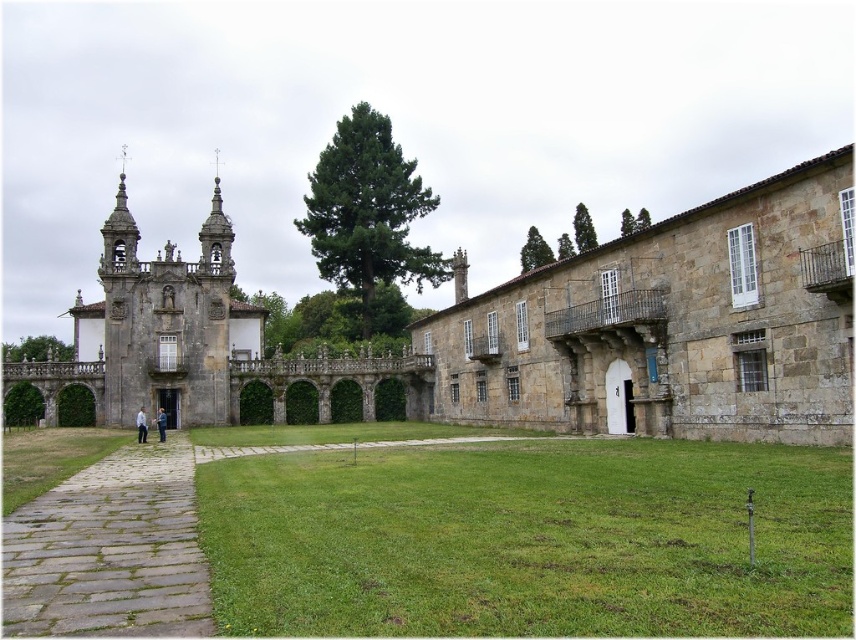
You are a tourist standing at the entrance of the historic site. You see the brown stone building at center and the gray stone path at lower left. Which object is higher in elevation?

The brown stone building at center is taller than the gray stone path at lower left, so the brown stone building at center is higher in elevation.

You are standing in front of the historic stone building and notice a light blue fabric jacket at center and green grass at center. Which object is positioned to the right of the other?

The green grass at center is to the right of the light blue fabric jacket at center according to the description.

You are standing in front of the historic stone building and see the green grass at center and the light blue fabric jacket at center. Which object takes up more space in the image?

The green grass at center is larger in size than the light blue fabric jacket at center, so the green grass at center takes up more space in the image.